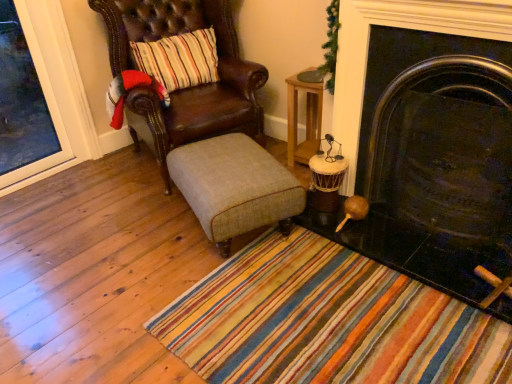
Measure the distance between point (x=482, y=133) and camera.

5.78 feet.

Image resolution: width=512 pixels, height=384 pixels. What do you see at coordinates (434, 145) in the screenshot?
I see `black glossy fireplace at right` at bounding box center [434, 145].

The width and height of the screenshot is (512, 384). What do you see at coordinates (306, 115) in the screenshot?
I see `wooden table at upper right` at bounding box center [306, 115].

Where is `wooden table at upper right`? The image size is (512, 384). wooden table at upper right is located at coordinates (306, 115).

Locate an element on the screen. wooden candle holder at lower right is located at coordinates (326, 177).

What do you see at coordinates (326, 177) in the screenshot? I see `wooden candle holder at lower right` at bounding box center [326, 177].

Locate an element on the screen. black glossy fireplace at right is located at coordinates (434, 145).

Can you confirm if beige fabric stool at center is wider than black glossy fireplace at right?

Correct, the width of beige fabric stool at center exceeds that of black glossy fireplace at right.

At what (x,y) coordinates should I click in order to perform the action: click on stool on the left of black glossy fireplace at right. Please return your answer as a coordinate pair (x, y). The height and width of the screenshot is (384, 512). Looking at the image, I should click on (234, 187).

Is black glossy fireplace at right located within beige fabric stool at center?

No, black glossy fireplace at right is located outside of beige fabric stool at center.

Is point (204, 209) closer or farther from the camera than point (389, 139)?

Point (204, 209) is positioned closer to the camera compared to point (389, 139).

Could you tell me if black glossy fireplace at right is facing wooden table at upper right?

No, black glossy fireplace at right is not oriented towards wooden table at upper right.

Does black glossy fireplace at right have a lesser height compared to wooden table at upper right?

No.

Based on the photo, is black glossy fireplace at right outside of wooden table at upper right?

Yes, black glossy fireplace at right is not within wooden table at upper right.

Which of these two, black glossy fireplace at right or wooden table at upper right, is thinner?

Thinner between the two is black glossy fireplace at right.

Is leather chair at left wider than black glossy fireplace at right?

Yes, leather chair at left is wider than black glossy fireplace at right.

From a real-world perspective, is leather chair at left positioned over black glossy fireplace at right based on gravity?

Yes, from a real-world perspective, leather chair at left is on top of black glossy fireplace at right.

Is leather chair at left turned away from black glossy fireplace at right?

No.

From the image's perspective, which one is positioned lower, leather chair at left or black glossy fireplace at right?

black glossy fireplace at right, from the image's perspective.

Is wooden candle holder at lower right oriented towards beige fabric stool at center?

Yes.

From the image's perspective, relative to beige fabric stool at center, is wooden candle holder at lower right above or below?

wooden candle holder at lower right is above beige fabric stool at center.

Image resolution: width=512 pixels, height=384 pixels. I want to click on stool that is below the wooden candle holder at lower right (from the image's perspective), so click(x=234, y=187).

Considering the relative positions of wooden candle holder at lower right and beige fabric stool at center in the image provided, is wooden candle holder at lower right to the left or to the right of beige fabric stool at center?

wooden candle holder at lower right is positioned on beige fabric stool at center's right side.

Consider the image. Is leather chair at left not close to wooden table at upper right?

No, there isn't a large distance between leather chair at left and wooden table at upper right.

Considering the relative sizes of leather chair at left and wooden table at upper right in the image provided, is leather chair at left bigger than wooden table at upper right?

Yes.

In the scene shown: Can you confirm if leather chair at left is taller than wooden table at upper right?

Indeed, leather chair at left has a greater height compared to wooden table at upper right.

Is wooden table at upper right at the back of leather chair at left?

No, wooden table at upper right is not at the back of leather chair at left.

Considering the sizes of black glossy fireplace at right and beige fabric stool at center in the image, is black glossy fireplace at right wider or thinner than beige fabric stool at center?

black glossy fireplace at right is thinner than beige fabric stool at center.

Is black glossy fireplace at right spatially inside beige fabric stool at center, or outside of it?

black glossy fireplace at right lies outside beige fabric stool at center.

From a real-world perspective, relative to beige fabric stool at center, is black glossy fireplace at right vertically above or below?

black glossy fireplace at right is above beige fabric stool at center.

Does black glossy fireplace at right have a larger size compared to beige fabric stool at center?

Yes, black glossy fireplace at right is bigger than beige fabric stool at center.

Which point is more forward, (317,107) or (377,26)?

Positioned in front is point (377,26).

Between wooden table at upper right and black glossy fireplace at right, which one appears on the left side from the viewer's perspective?

Positioned to the left is wooden table at upper right.

Does wooden table at upper right turn towards black glossy fireplace at right?

No, wooden table at upper right is not oriented towards black glossy fireplace at right.

The height and width of the screenshot is (384, 512). I want to click on table that appears below the black glossy fireplace at right (from a real-world perspective), so click(306, 115).

Locate an element on the screen. The height and width of the screenshot is (384, 512). stool located on the left of black glossy fireplace at right is located at coordinates (234, 187).

Find the location of a particular element. table above the black glossy fireplace at right (from the image's perspective) is located at coordinates (306, 115).

Estimate the real-world distances between objects in this image. Which object is further from leather chair at left, beige fabric stool at center or wooden candle holder at lower right?

wooden candle holder at lower right.

When comparing their distances from wooden candle holder at lower right, does beige fabric stool at center or wooden table at upper right seem further?

The object further to wooden candle holder at lower right is wooden table at upper right.

Looking at the image, which one is located closer to beige fabric stool at center, wooden table at upper right or black glossy fireplace at right?

black glossy fireplace at right lies closer to beige fabric stool at center than the other object.

Based on their spatial positions, is black glossy fireplace at right or wooden table at upper right closer to beige fabric stool at center?

Among the two, black glossy fireplace at right is located nearer to beige fabric stool at center.

Based on the photo, which object lies further to the anchor point wooden candle holder at lower right, black glossy fireplace at right or beige fabric stool at center?

black glossy fireplace at right is positioned further to the anchor wooden candle holder at lower right.

From the image, which object appears to be nearer to wooden candle holder at lower right, wooden table at upper right or beige fabric stool at center?

beige fabric stool at center is closer to wooden candle holder at lower right.

Looking at this image, based on their spatial positions, is wooden candle holder at lower right or wooden table at upper right closer to black glossy fireplace at right?

Based on the image, wooden candle holder at lower right appears to be nearer to black glossy fireplace at right.

Based on their spatial positions, is leather chair at left or wooden candle holder at lower right closer to wooden table at upper right?

wooden candle holder at lower right is positioned closer to the anchor wooden table at upper right.

This screenshot has width=512, height=384. What are the coordinates of `candle holder situated between leather chair at left and black glossy fireplace at right from left to right` in the screenshot? It's located at (326, 177).

At what (x,y) coordinates should I click in order to perform the action: click on candle holder between beige fabric stool at center and wooden table at upper right along the z-axis. Please return your answer as a coordinate pair (x, y). The height and width of the screenshot is (384, 512). Looking at the image, I should click on (326, 177).

Image resolution: width=512 pixels, height=384 pixels. Find the location of `stool between leather chair at left and wooden candle holder at lower right`. stool between leather chair at left and wooden candle holder at lower right is located at coordinates (234, 187).

This screenshot has width=512, height=384. Identify the location of table between leather chair at left and black glossy fireplace at right in the horizontal direction. (306, 115).